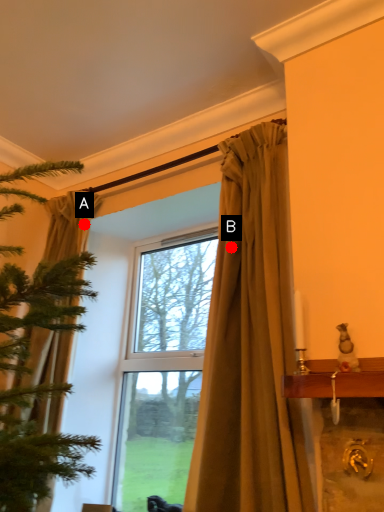
Question: Two points are circled on the image, labeled by A and B beside each circle. Which point is further to the camera?

Choices:
 (A) A is further
 (B) B is further

Answer: (A)